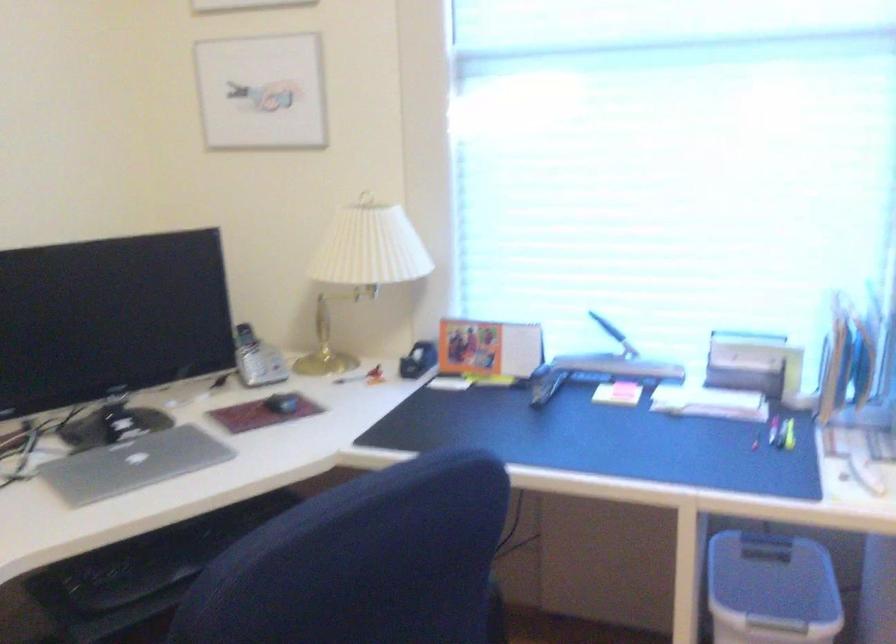
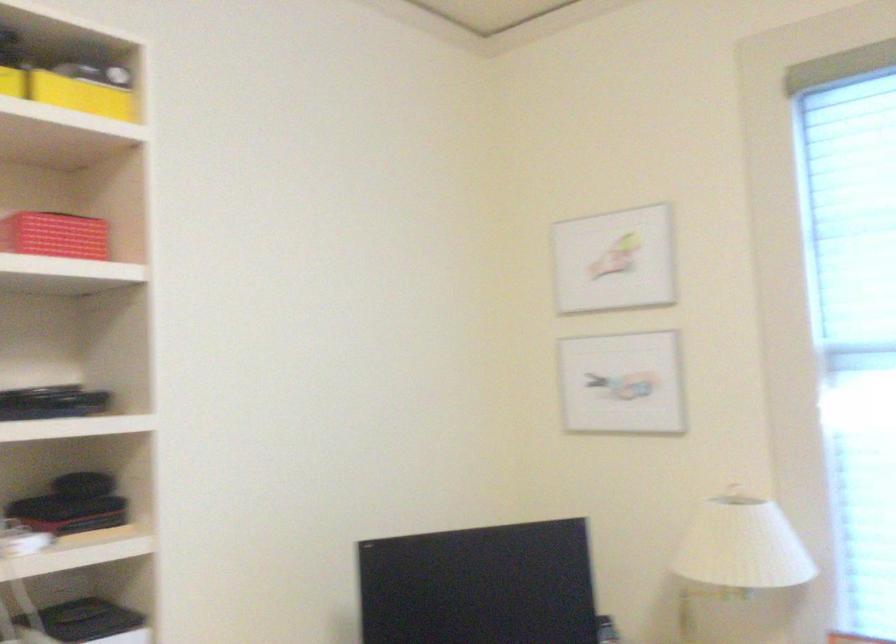
What movement of the cameraman would produce the second image?

The movement direction of the cameraman is left, backward.